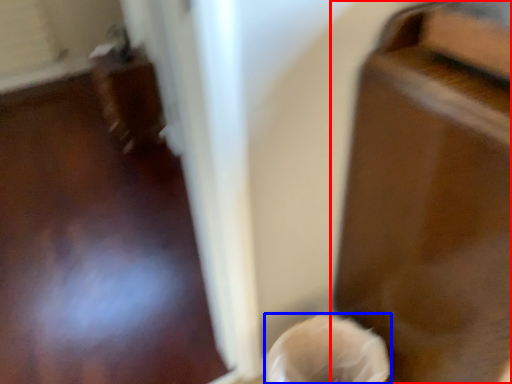
Question: Which object appears closest to the camera in this image, furniture (highlighted by a red box) or woman (highlighted by a blue box)?

Choices:
 (A) furniture
 (B) woman

Answer: (A)